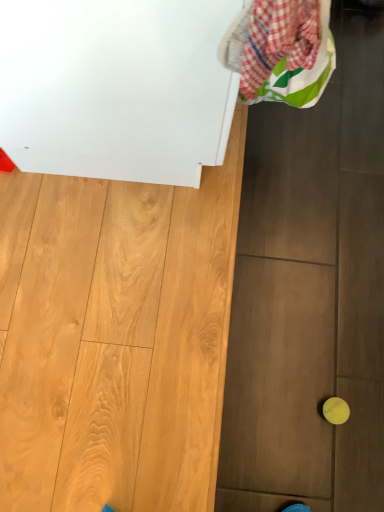
Question: Based on their positions, is yellow rubber ball at lower right located to the left or right of plaid fabric laundry at upper right?

Choices:
 (A) right
 (B) left

Answer: (A)

Question: Based on their sizes in the image, would you say yellow rubber ball at lower right is bigger or smaller than plaid fabric laundry at upper right?

Choices:
 (A) small
 (B) big

Answer: (A)

Question: Which object is positioned closest to the white glossy cabinet at upper left?

Choices:
 (A) yellow rubber ball at lower right
 (B) plaid fabric laundry at upper right

Answer: (B)

Question: Which object is the farthest from the white glossy cabinet at upper left?

Choices:
 (A) plaid fabric laundry at upper right
 (B) yellow rubber ball at lower right

Answer: (B)